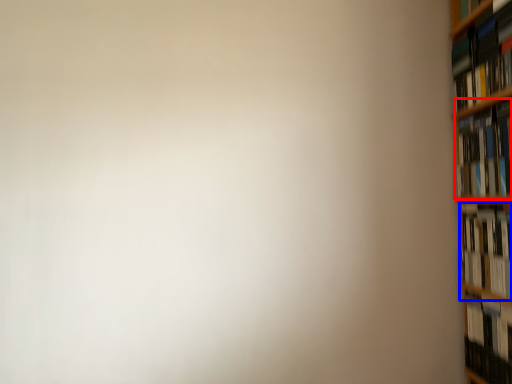
Question: Among these objects, which one is farthest to the camera, book (highlighted by a red box) or book (highlighted by a blue box)?

Choices:
 (A) book
 (B) book

Answer: (A)